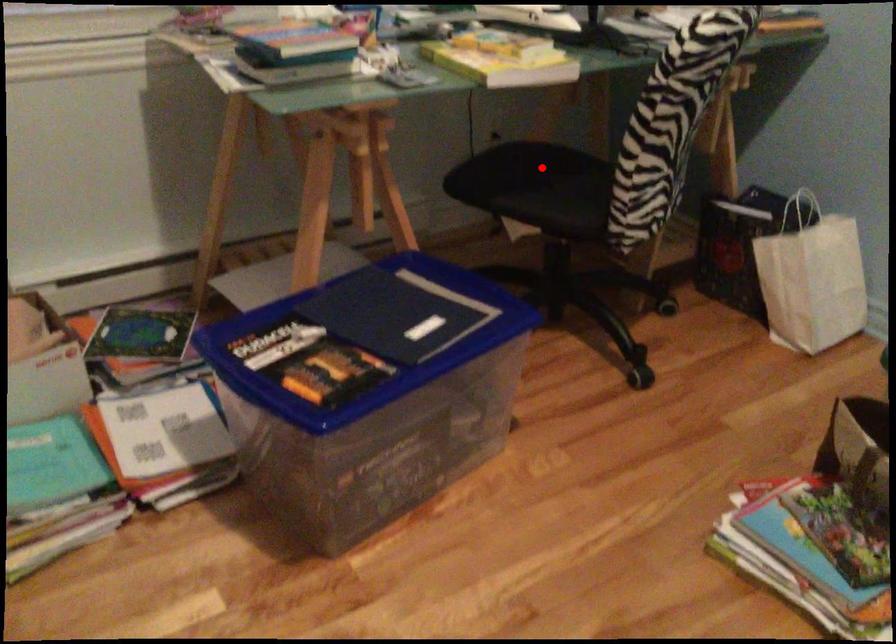
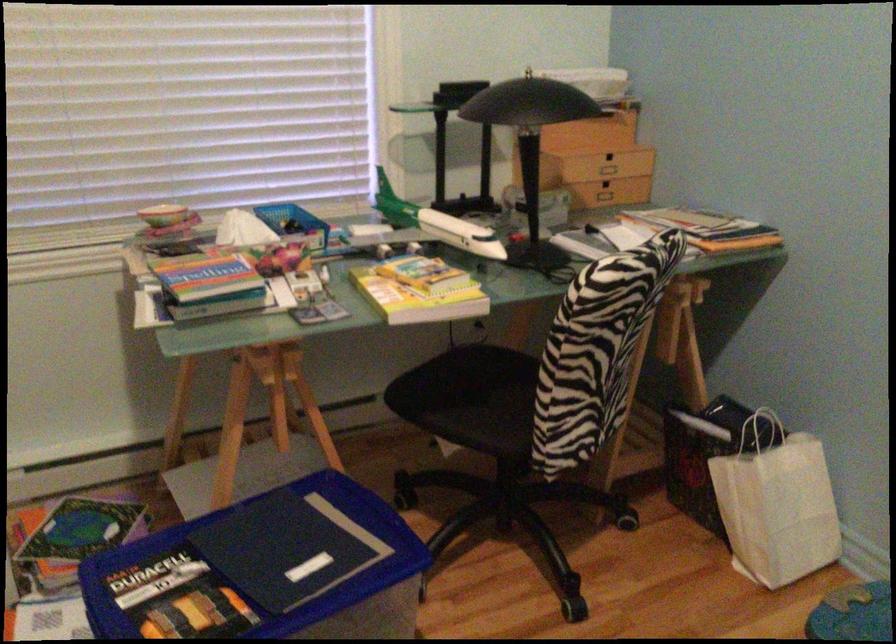
Locate, in the second image, the point that corresponds to the highlighted location in the first image.

(487, 377)